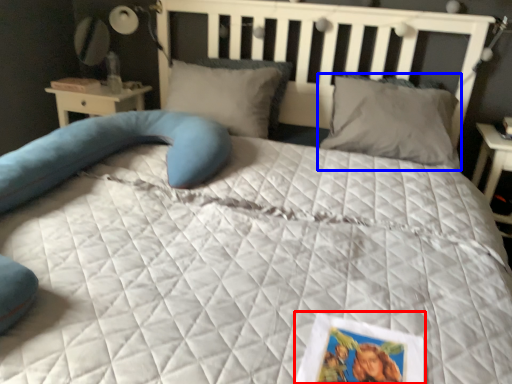
Question: Which object appears farthest to the camera in this image, postcard (highlighted by a red box) or pillow (highlighted by a blue box)?

Choices:
 (A) postcard
 (B) pillow

Answer: (B)